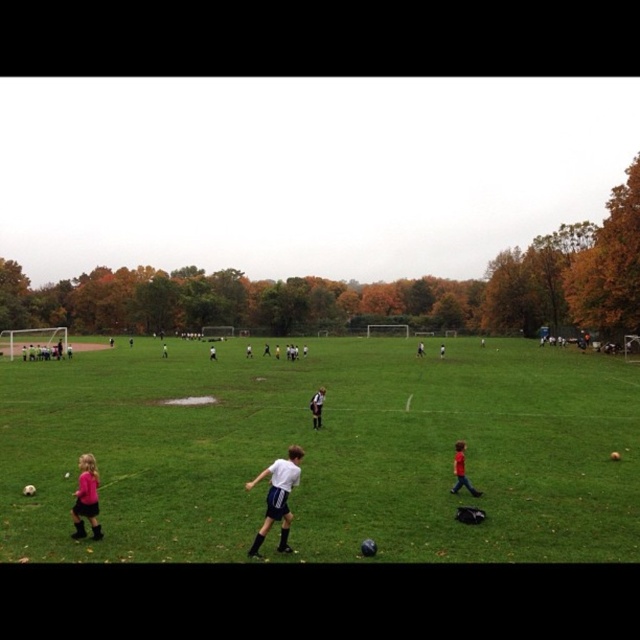
Question: Is green grassy field at center positioned at the back of white jersey at center?

Choices:
 (A) no
 (B) yes

Answer: (A)

Question: Which point is farther to the camera?

Choices:
 (A) (580, 372)
 (B) (83, 497)
 (C) (312, 410)

Answer: (A)

Question: Can you confirm if white matte shorts at center is wider than white jersey at center?

Choices:
 (A) yes
 (B) no

Answer: (A)

Question: Among these points, which one is farthest from the camera?

Choices:
 (A) (323, 392)
 (B) (260, 532)

Answer: (A)

Question: Can you confirm if red matte shirt at center is smaller than white jersey at center?

Choices:
 (A) no
 (B) yes

Answer: (B)

Question: Which point is closer to the camera?

Choices:
 (A) red matte shirt at center
 (B) pink matte dress at lower left

Answer: (B)